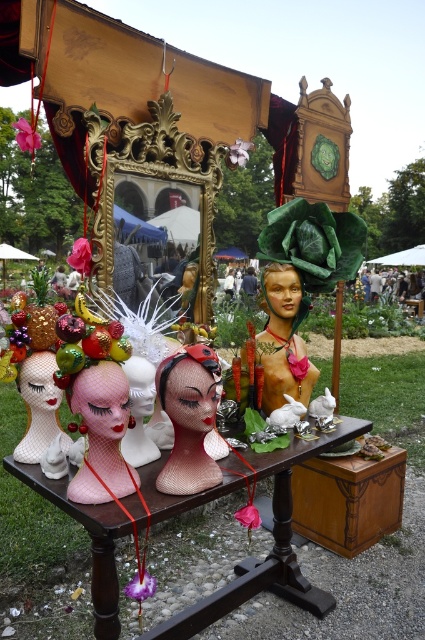
Which is below, pink mesh head at center or matte plastic doll at center?

pink mesh head at center is lower down.

Consider the image. Can you confirm if pink mesh head at center is wider than matte plastic doll at center?

In fact, pink mesh head at center might be narrower than matte plastic doll at center.

The width and height of the screenshot is (425, 640). Find the location of `pink mesh head at center`. pink mesh head at center is located at coordinates (102, 433).

Locate an element on the screen. pink mesh head at center is located at coordinates (102, 433).

Can you confirm if wooden table at center is taller than matte plastic doll at center?

Yes.

Is wooden table at center above matte plastic doll at center?

No.

Identify the location of wooden table at center. (272, 536).

Image resolution: width=425 pixels, height=640 pixels. In order to click on wooden table at center in this screenshot , I will do `click(272, 536)`.

Can you confirm if wooden table at center is positioned to the right of satin pink wig at center?

Indeed, wooden table at center is positioned on the right side of satin pink wig at center.

Can you confirm if wooden table at center is positioned to the left of satin pink wig at center?

Incorrect, wooden table at center is not on the left side of satin pink wig at center.

Locate an element on the screen. This screenshot has width=425, height=640. wooden table at center is located at coordinates (272, 536).

You are a GUI agent. You are given a task and a screenshot of the screen. Output one action in this format:
    pyautogui.click(x=<x>, y=<y>)
    Task: Click on the wooden table at center
    
    Given the screenshot: What is the action you would take?
    pyautogui.click(x=272, y=536)